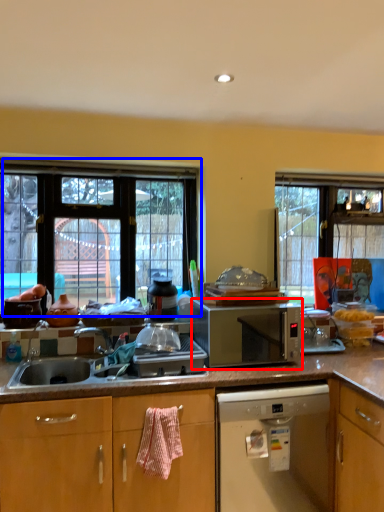
Question: Among these objects, which one is nearest to the camera, microwave oven (highlighted by a red box) or window (highlighted by a blue box)?

Choices:
 (A) microwave oven
 (B) window

Answer: (A)